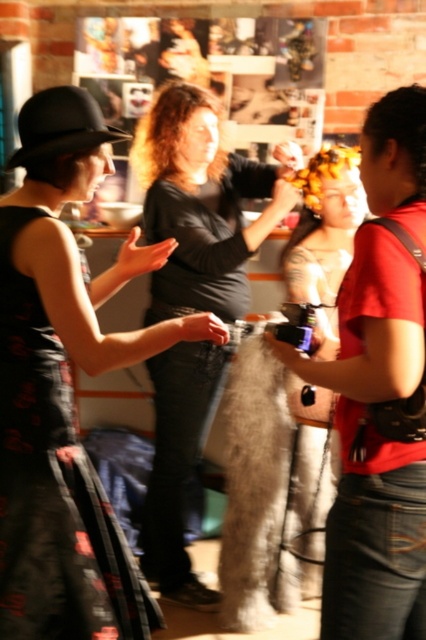
You are standing in the room and want to find the black fuzzy coat at center. Based on the coordinates provided, where should you look relative to the brick wall?

The black fuzzy coat at center is located at coordinates point (x=201, y=204), which is approximately 32.0 cm from the left edge and 47.2 cm from the bottom edge of the room, assuming the room is 100 cm in width and height. Since the brick wall is the background, you should look towards the center area near the middle right side of the wall.